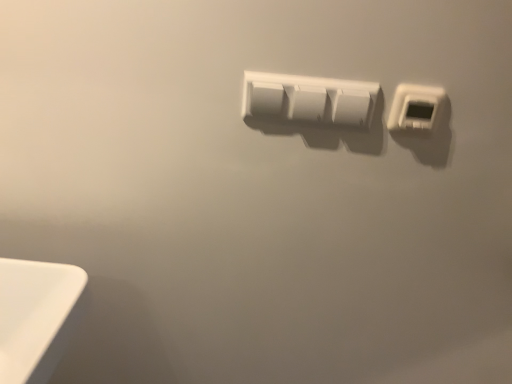
Question: From a real-world perspective, is white plastic power plugs and sockets at center, which appears as the second power plugs and sockets when viewed from the right, located beneath white plastic thermostat at upper right, which appears as the second power plugs and sockets when viewed from the left?

Choices:
 (A) no
 (B) yes

Answer: (B)

Question: Is white plastic power plugs and sockets at center, which appears as the second power plugs and sockets when viewed from the right, outside of white plastic thermostat at upper right, which ranks as the 1th power plugs and sockets in right-to-left order?

Choices:
 (A) yes
 (B) no

Answer: (A)

Question: Can you confirm if white plastic power plugs and sockets at center, which appears as the second power plugs and sockets when viewed from the right, is thinner than white plastic thermostat at upper right, which ranks as the 1th power plugs and sockets in right-to-left order?

Choices:
 (A) yes
 (B) no

Answer: (A)

Question: Is white plastic power plugs and sockets at center, which ranks as the first power plugs and sockets in left-to-right order, far from white plastic thermostat at upper right, which appears as the second power plugs and sockets when viewed from the left?

Choices:
 (A) no
 (B) yes

Answer: (A)

Question: Can white plastic thermostat at upper right, which ranks as the 1th power plugs and sockets in right-to-left order, be found inside white plastic power plugs and sockets at center, which appears as the second power plugs and sockets when viewed from the right?

Choices:
 (A) no
 (B) yes

Answer: (A)

Question: Does white plastic power plugs and sockets at center, which appears as the second power plugs and sockets when viewed from the right, lie behind white plastic thermostat at upper right, which appears as the second power plugs and sockets when viewed from the left?

Choices:
 (A) yes
 (B) no

Answer: (A)

Question: Is white plastic thermostat at upper right, which appears as the second power plugs and sockets when viewed from the left, surrounding white plastic power plugs and sockets at center, which ranks as the first power plugs and sockets in left-to-right order?

Choices:
 (A) no
 (B) yes

Answer: (A)

Question: Does white plastic thermostat at upper right, which appears as the second power plugs and sockets when viewed from the left, have a lesser height compared to white plastic power plugs and sockets at center, which appears as the second power plugs and sockets when viewed from the right?

Choices:
 (A) yes
 (B) no

Answer: (A)

Question: Considering the relative sizes of white plastic thermostat at upper right, which appears as the second power plugs and sockets when viewed from the left, and white plastic power plugs and sockets at center, which appears as the second power plugs and sockets when viewed from the right, in the image provided, is white plastic thermostat at upper right, which appears as the second power plugs and sockets when viewed from the left, smaller than white plastic power plugs and sockets at center, which appears as the second power plugs and sockets when viewed from the right,?

Choices:
 (A) yes
 (B) no

Answer: (A)

Question: Is white plastic thermostat at upper right, which appears as the second power plugs and sockets when viewed from the left, at the left side of white plastic power plugs and sockets at center, which appears as the second power plugs and sockets when viewed from the right?

Choices:
 (A) no
 (B) yes

Answer: (A)

Question: Considering the relative positions of white plastic thermostat at upper right, which ranks as the 1th power plugs and sockets in right-to-left order, and white plastic power plugs and sockets at center, which appears as the second power plugs and sockets when viewed from the right, in the image provided, is white plastic thermostat at upper right, which ranks as the 1th power plugs and sockets in right-to-left order, in front of white plastic power plugs and sockets at center, which appears as the second power plugs and sockets when viewed from the right,?

Choices:
 (A) yes
 (B) no

Answer: (A)

Question: Is white plastic thermostat at upper right, which ranks as the 1th power plugs and sockets in right-to-left order, bigger than white plastic power plugs and sockets at center, which ranks as the first power plugs and sockets in left-to-right order?

Choices:
 (A) no
 (B) yes

Answer: (A)

Question: Which is correct: white plastic thermostat at upper right, which ranks as the 1th power plugs and sockets in right-to-left order, is inside white plastic power plugs and sockets at center, which appears as the second power plugs and sockets when viewed from the right, or outside of it?

Choices:
 (A) outside
 (B) inside

Answer: (A)